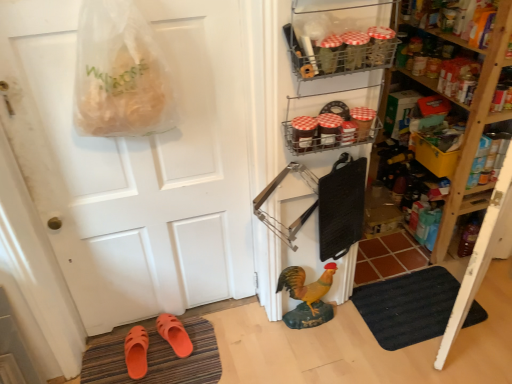
Where is `vacant area located to the right-hand side of orange rubber slippers at lower left, the first footwear when ordered from left to right`? This screenshot has height=384, width=512. vacant area located to the right-hand side of orange rubber slippers at lower left, the first footwear when ordered from left to right is located at coordinates point(174,359).